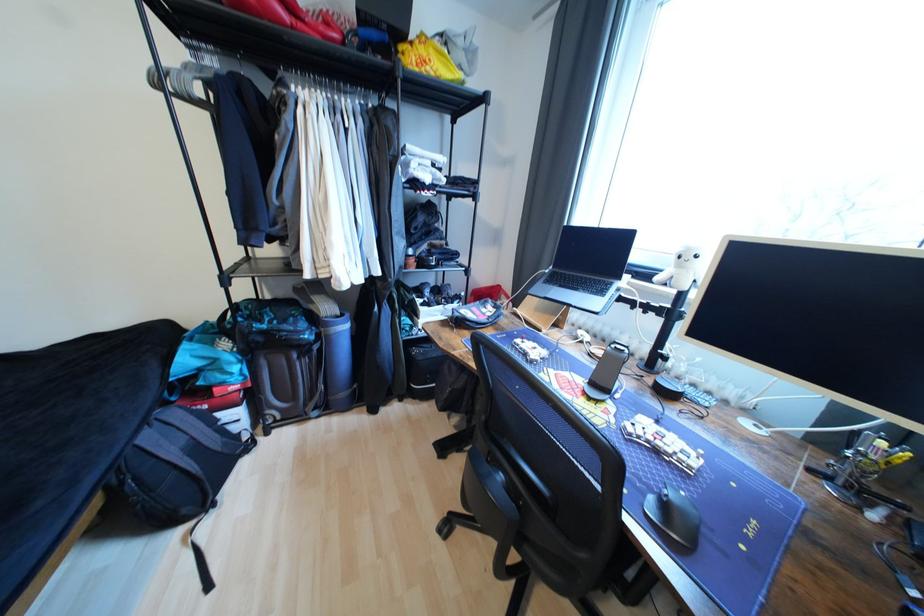
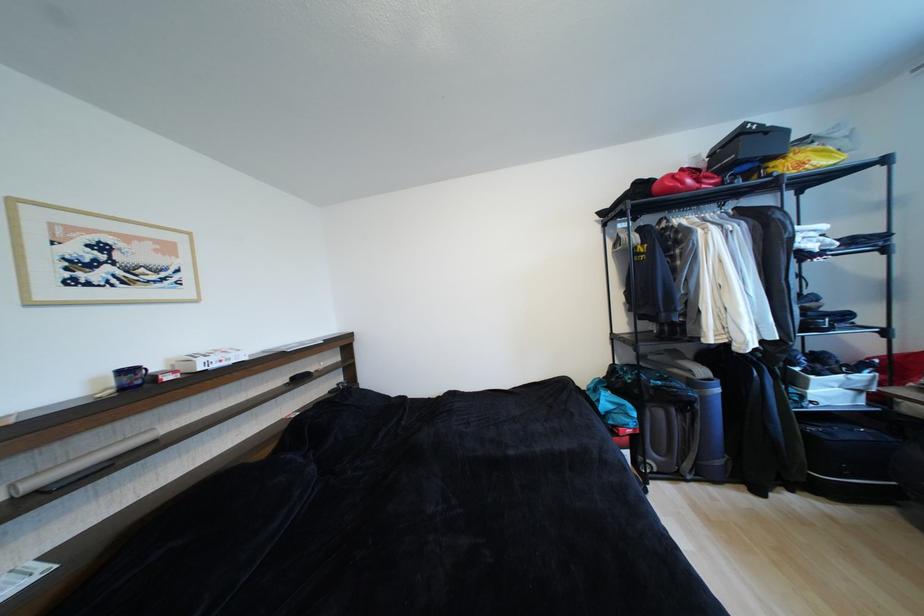
Find the pixel in the second image that matches (x=407, y=49) in the first image.

(780, 166)